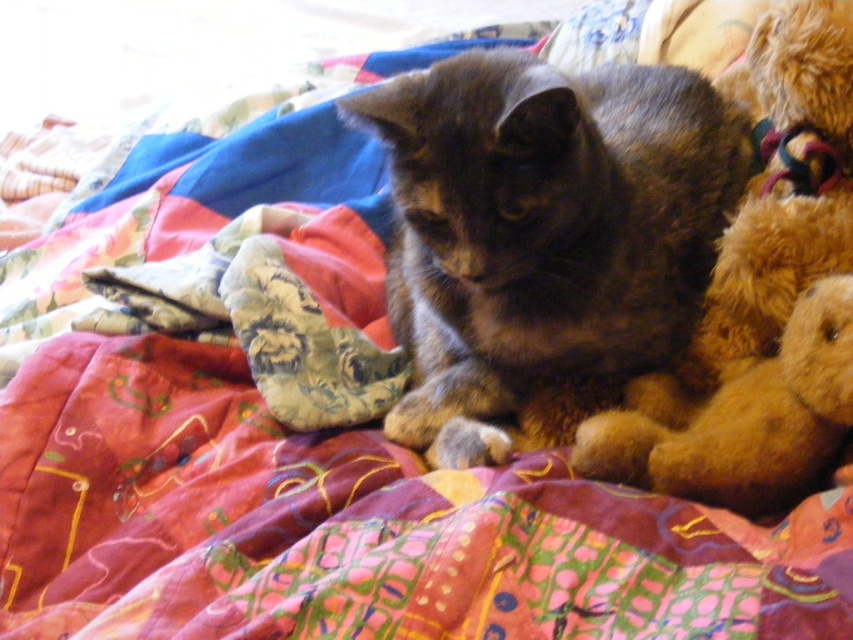
Is point (581, 145) in front of point (746, 259)?

Yes, point (581, 145) is closer to viewer.

Is point (624, 337) positioned before point (683, 493)?

No, it is behind (683, 493).

This screenshot has height=640, width=853. In order to click on dark brown fur cat at center in this screenshot , I will do `click(543, 228)`.

Between dark brown fur cat at center and fuzzy brown teddy bear at right, which one is positioned higher?

Positioned higher is dark brown fur cat at center.

Can you confirm if dark brown fur cat at center is positioned to the right of fuzzy brown teddy bear at right?

No, dark brown fur cat at center is not to the right of fuzzy brown teddy bear at right.

What do you see at coordinates (543, 228) in the screenshot?
I see `dark brown fur cat at center` at bounding box center [543, 228].

Locate an element on the screen. The height and width of the screenshot is (640, 853). dark brown fur cat at center is located at coordinates (543, 228).

From the picture: Is fluffy brown teddy bear at right positioned behind fuzzy brown teddy bear at right?

No, it is not.

Is point (836, 307) less distant than point (625, 412)?

Yes, point (836, 307) is in front of point (625, 412).

Image resolution: width=853 pixels, height=640 pixels. Identify the location of fluffy brown teddy bear at right. tap(759, 305).